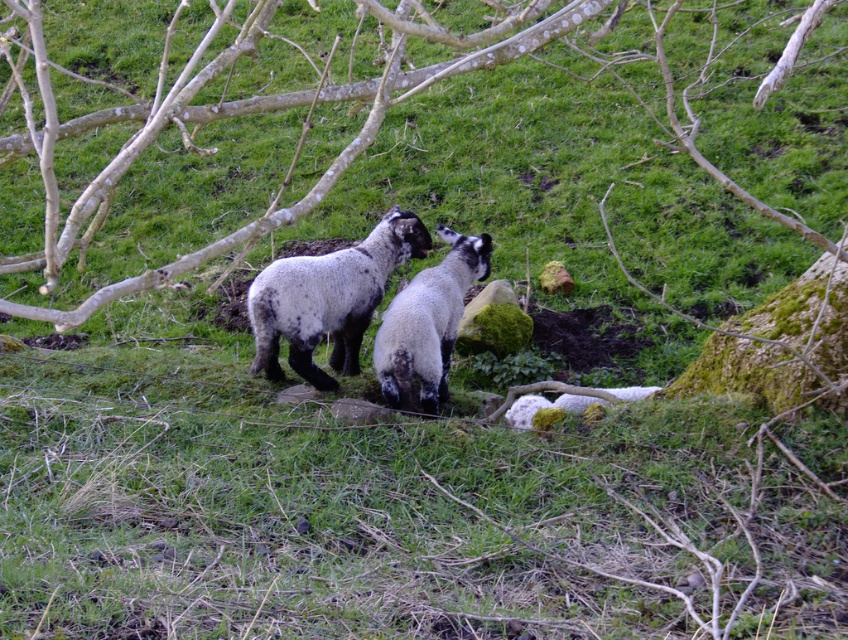
Question: Which point is closer to the camera?

Choices:
 (A) speckled wool sheep at center
 (B) speckled woolen sheep at center

Answer: (A)

Question: Can you confirm if speckled woolen sheep at center is positioned above speckled wool sheep at center?

Choices:
 (A) yes
 (B) no

Answer: (A)

Question: Is speckled woolen sheep at center smaller than speckled wool sheep at center?

Choices:
 (A) no
 (B) yes

Answer: (A)

Question: Is speckled woolen sheep at center bigger than speckled wool sheep at center?

Choices:
 (A) yes
 (B) no

Answer: (A)

Question: Which point is farther to the camera?

Choices:
 (A) speckled wool sheep at center
 (B) speckled woolen sheep at center

Answer: (B)